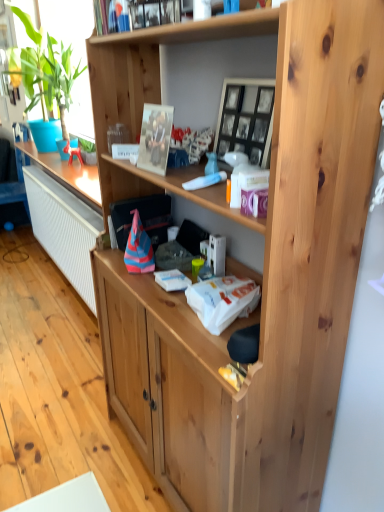
Question: Which direction should I rotate to look at black glass picture frame at upper center, which ranks as the second picture frame in left-to-right order, — up or down?

Choices:
 (A) down
 (B) up

Answer: (B)

Question: Does black glass picture frame at upper center, which ranks as the second picture frame in left-to-right order, have a lesser height compared to metallic silver picture frame at upper center, the 1th picture frame in the left-to-right sequence?

Choices:
 (A) no
 (B) yes

Answer: (A)

Question: Considering the relative positions of black glass picture frame at upper center, which ranks as the second picture frame in left-to-right order, and metallic silver picture frame at upper center, the 1th picture frame in the left-to-right sequence, in the image provided, is black glass picture frame at upper center, which ranks as the second picture frame in left-to-right order, behind metallic silver picture frame at upper center, the 1th picture frame in the left-to-right sequence,?

Choices:
 (A) no
 (B) yes

Answer: (A)

Question: Is black glass picture frame at upper center, which is the 1th picture frame from right to left, far away from metallic silver picture frame at upper center, the 2th picture frame in the right-to-left sequence?

Choices:
 (A) no
 (B) yes

Answer: (A)

Question: Considering the relative sizes of black glass picture frame at upper center, which is the 1th picture frame from right to left, and metallic silver picture frame at upper center, the 2th picture frame in the right-to-left sequence, in the image provided, is black glass picture frame at upper center, which is the 1th picture frame from right to left, wider than metallic silver picture frame at upper center, the 2th picture frame in the right-to-left sequence,?

Choices:
 (A) yes
 (B) no

Answer: (A)

Question: Is black glass picture frame at upper center, which is the 1th picture frame from right to left, oriented away from metallic silver picture frame at upper center, the 1th picture frame in the left-to-right sequence?

Choices:
 (A) yes
 (B) no

Answer: (B)

Question: Is black glass picture frame at upper center, which ranks as the second picture frame in left-to-right order, touching metallic silver picture frame at upper center, the 1th picture frame in the left-to-right sequence?

Choices:
 (A) no
 (B) yes

Answer: (A)

Question: From a real-world perspective, does green leafy plant at left sit lower than metallic silver photo frame at upper center?

Choices:
 (A) yes
 (B) no

Answer: (A)

Question: From the image's perspective, is green leafy plant at left on top of metallic silver photo frame at upper center?

Choices:
 (A) no
 (B) yes

Answer: (B)

Question: From a real-world perspective, is green leafy plant at left on metallic silver photo frame at upper center?

Choices:
 (A) yes
 (B) no

Answer: (B)

Question: Does green leafy plant at left have a larger size compared to metallic silver photo frame at upper center?

Choices:
 (A) yes
 (B) no

Answer: (A)

Question: Can you confirm if green leafy plant at left is smaller than metallic silver photo frame at upper center?

Choices:
 (A) no
 (B) yes

Answer: (A)

Question: Could metallic silver photo frame at upper center be considered to be inside green leafy plant at left?

Choices:
 (A) no
 (B) yes

Answer: (A)

Question: Is the depth of black glass picture frame at upper center, which ranks as the second picture frame in left-to-right order, less than that of green leafy plant at left?

Choices:
 (A) yes
 (B) no

Answer: (A)